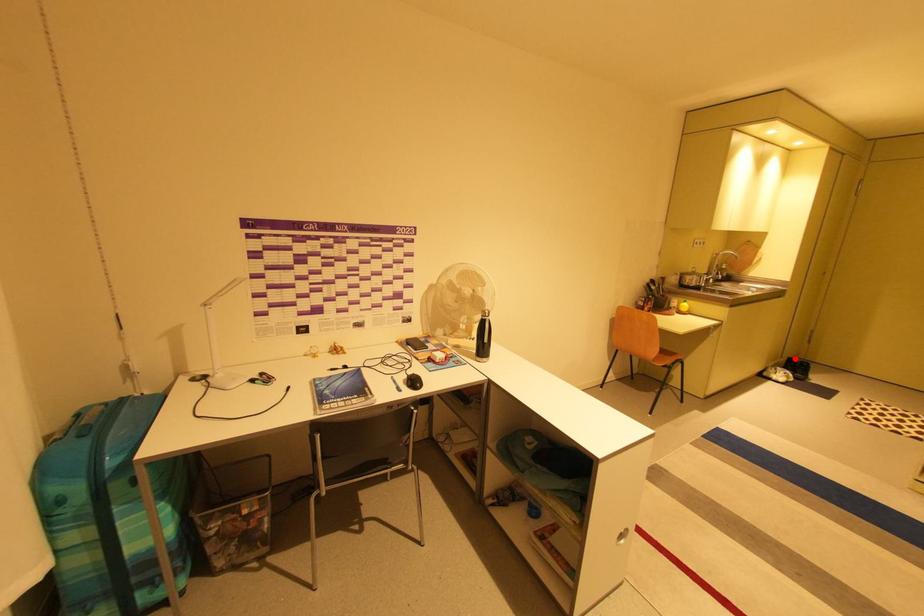
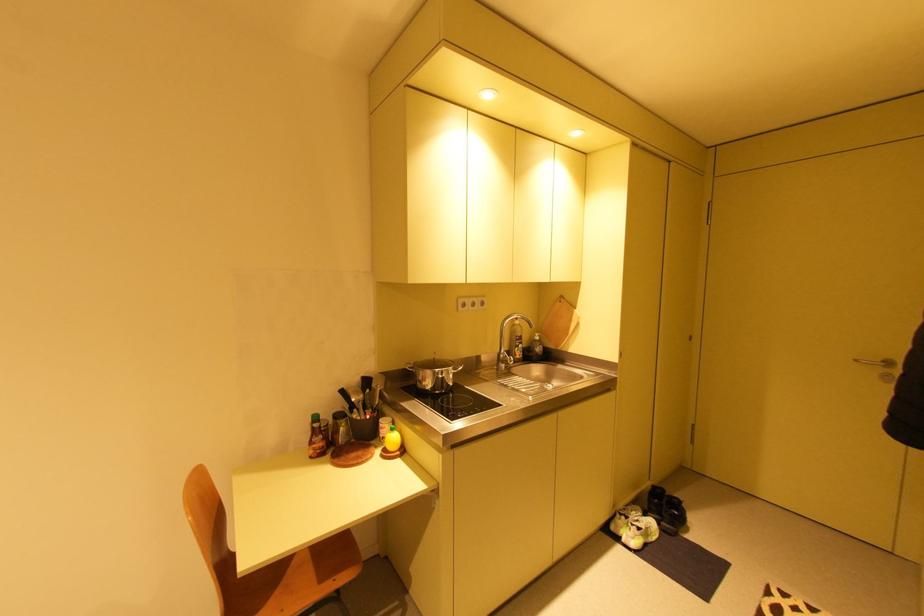
In the second image, find the point that corresponds to the highlighted location in the first image.

(660, 487)